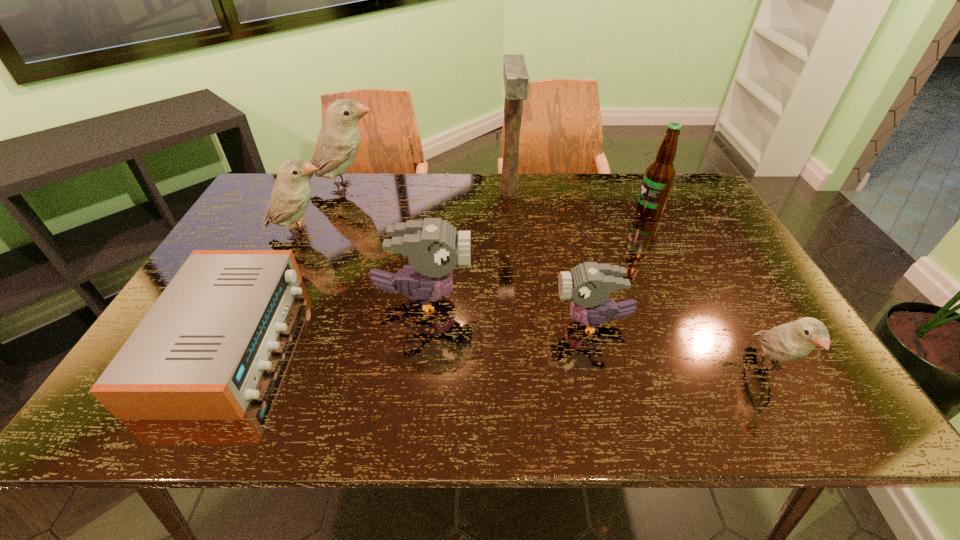
Where is `the tallest object`? The height and width of the screenshot is (540, 960). the tallest object is located at coordinates (516, 80).

The image size is (960, 540). Find the location of `mallet`. mallet is located at coordinates (516, 80).

Find the location of a particular element. Image resolution: width=960 pixels, height=540 pixels. the farthest bird is located at coordinates (338, 142).

Where is `the biggest white bird`? the biggest white bird is located at coordinates (338, 142).

What are the coordinates of `the seventh object from left to right` in the screenshot? It's located at (658, 180).

Identify the location of brown beer bottle. The image size is (960, 540). (658, 180).

You are a GUI agent. You are given a task and a screenshot of the screen. Output one action in this format:
    pyautogui.click(x=<x>, y=<y>)
    Task: Click on the second smallest white bird
    Image resolution: width=960 pixels, height=540 pixels.
    Given the screenshot: What is the action you would take?
    pyautogui.click(x=290, y=196)

Identify the location of the second farthest white bird. (290, 196).

Where is `the fourth object from left to right`? This screenshot has width=960, height=540. the fourth object from left to right is located at coordinates (434, 248).

This screenshot has height=540, width=960. Identify the location of the third bird from right to left. (434, 248).